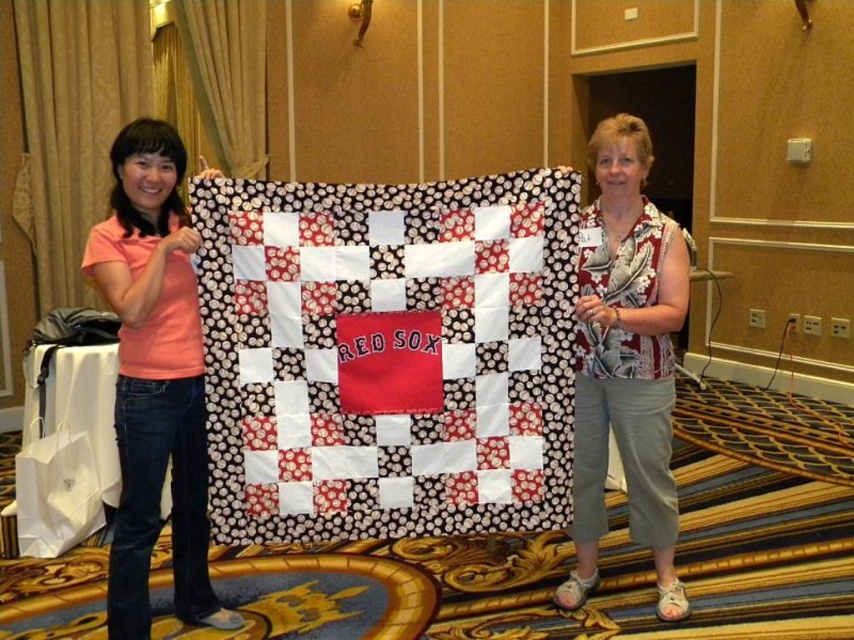
Measure the distance between red fabric quilt at center and camera.

red fabric quilt at center and camera are 2.12 meters apart.

Is red fabric quilt at center to the right of printed fabric blouse at center from the viewer's perspective?

In fact, red fabric quilt at center is to the left of printed fabric blouse at center.

Locate an element on the screen. This screenshot has height=640, width=854. red fabric quilt at center is located at coordinates (387, 355).

Does red fabric quilt at center appear over pink cotton shirt at left?

Indeed, red fabric quilt at center is positioned over pink cotton shirt at left.

Measure the distance between red fabric quilt at center and camera.

They are 6.96 feet apart.

The height and width of the screenshot is (640, 854). I want to click on red fabric quilt at center, so click(387, 355).

Which is more to the right, pink cotton shirt at left or printed fabric blouse at center?

printed fabric blouse at center

Who is more forward, (144, 129) or (606, 209)?

Positioned in front is point (144, 129).

Find the location of `pink cotton shirt at left`. pink cotton shirt at left is located at coordinates (154, 380).